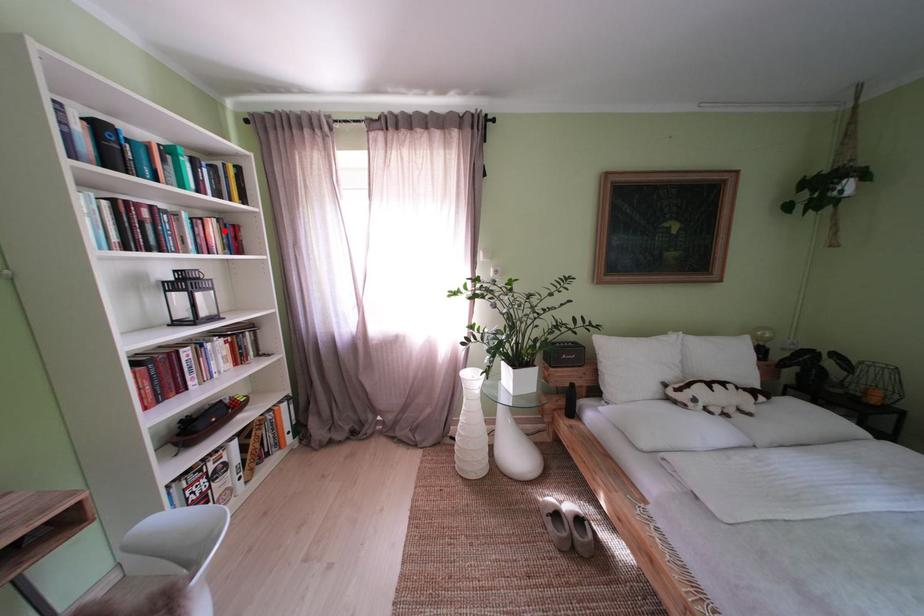
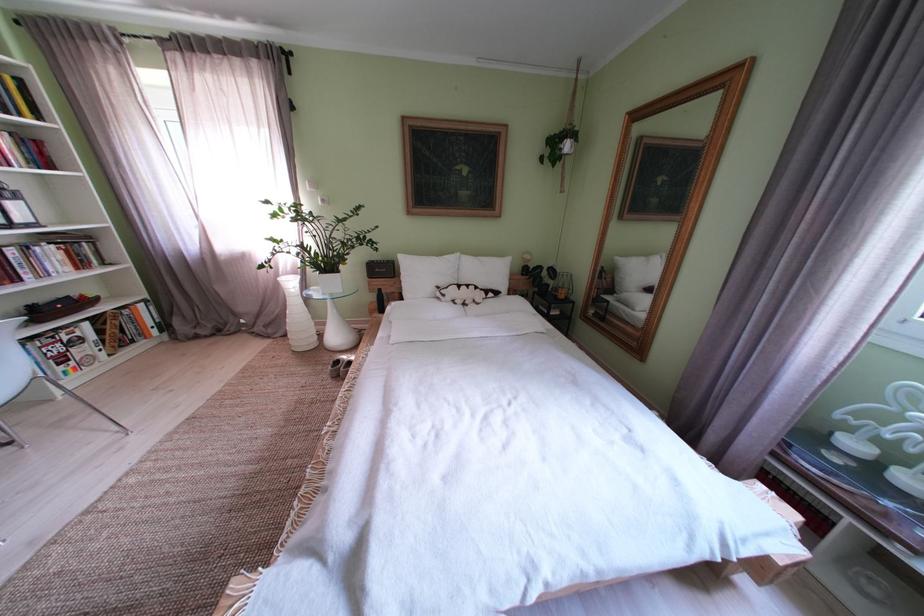
Where in the second image is the point corresponding to the highlighted location from the first image?

(16, 145)